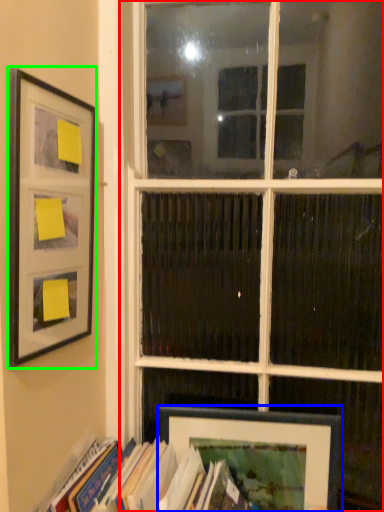
Question: Considering the real-world distances, which object is closest to window (highlighted by a red box)? picture frame (highlighted by a blue box) or picture frame (highlighted by a green box).

Choices:
 (A) picture frame
 (B) picture frame

Answer: (A)